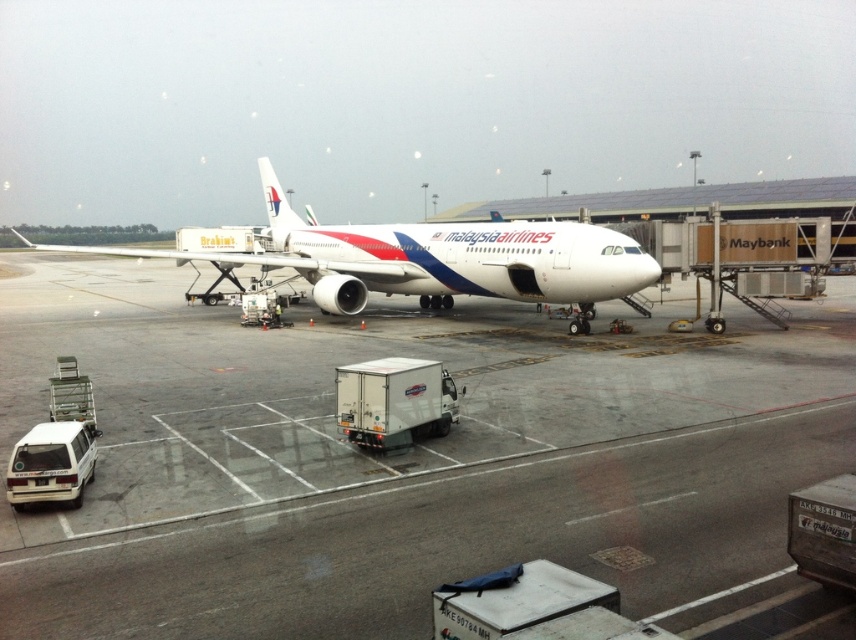
Is white glossy tarmac at center smaller than white glossy airplane at center?

Indeed, white glossy tarmac at center has a smaller size compared to white glossy airplane at center.

Between white glossy tarmac at center and white glossy airplane at center, which one is positioned higher?

white glossy airplane at center is higher up.

The height and width of the screenshot is (640, 856). What are the coordinates of `white glossy tarmac at center` in the screenshot? It's located at (393, 460).